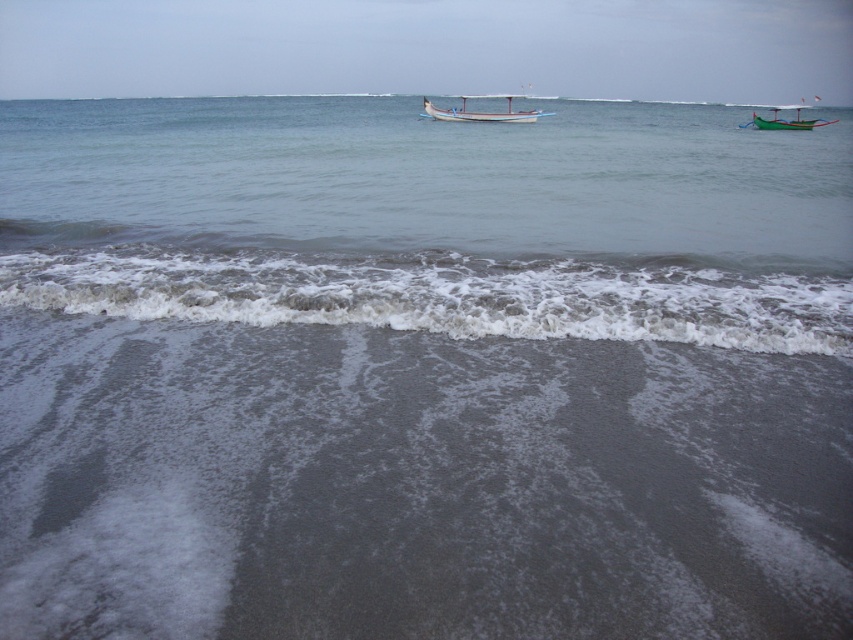
Between gray matte water at center and green wooden boat at upper right, which one appears on the left side from the viewer's perspective?

From the viewer's perspective, gray matte water at center appears more on the left side.

Which is behind, point (416, 99) or point (787, 120)?

Positioned behind is point (416, 99).

Does point (842, 320) come behind point (779, 106)?

No, (842, 320) is in front of (779, 106).

What are the coordinates of `gray matte water at center` in the screenshot? It's located at (432, 218).

Does gray matte water at center appear over white wooden boat at center?

Incorrect, gray matte water at center is not positioned above white wooden boat at center.

Find the location of a particular element. The image size is (853, 640). gray matte water at center is located at coordinates (432, 218).

Identify the location of gray matte water at center. The image size is (853, 640). (432, 218).

Looking at this image, is gray matte sand at lower center wider than white wooden boat at center?

No, gray matte sand at lower center is not wider than white wooden boat at center.

Does gray matte sand at lower center have a lesser width compared to white wooden boat at center?

Yes, gray matte sand at lower center is thinner than white wooden boat at center.

Who is more forward, (662, 316) or (517, 115)?

Point (662, 316) is in front.

Where is `gray matte sand at lower center`? The image size is (853, 640). gray matte sand at lower center is located at coordinates (440, 294).